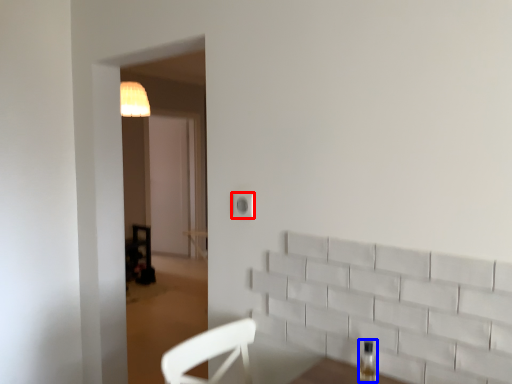
Question: Which of the following is the closest to the observer, electric outlet (highlighted by a red box) or bottle (highlighted by a blue box)?

Choices:
 (A) electric outlet
 (B) bottle

Answer: (B)